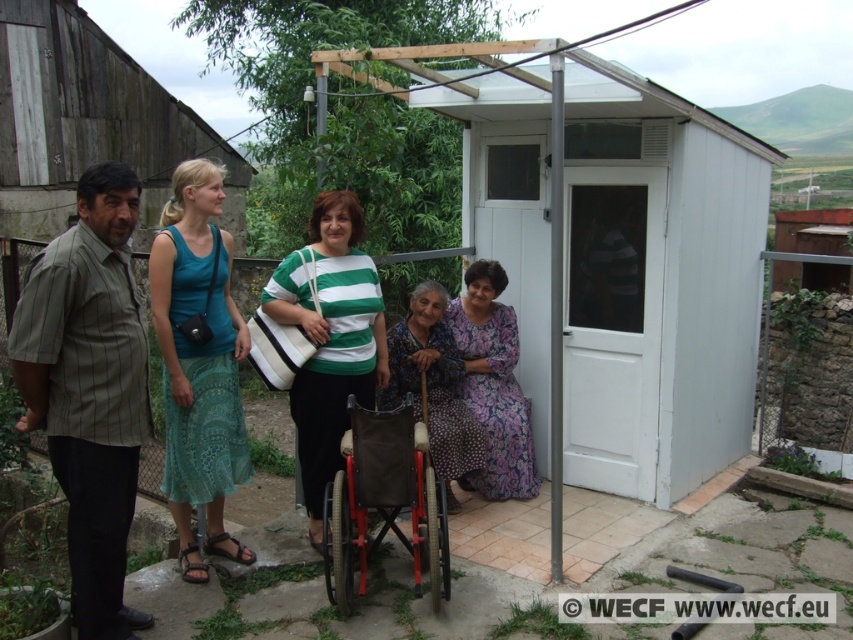
Question: Can you confirm if teal fabric dress at left is positioned below floral dress at lower center?

Choices:
 (A) yes
 (B) no

Answer: (B)

Question: Which object is positioned farthest from the floral dress at lower center?

Choices:
 (A) red metal wheelchair at center
 (B) green striped shirt at center
 (C) printed fabric dress at center

Answer: (A)

Question: Does teal fabric dress at left appear over red metal wheelchair at center?

Choices:
 (A) no
 (B) yes

Answer: (B)

Question: Does white plastic hut at center appear on the right side of green striped shirt at center?

Choices:
 (A) no
 (B) yes

Answer: (B)

Question: Which point is farther to the camera?

Choices:
 (A) white plastic hut at center
 (B) red metal wheelchair at center
 (C) green striped shirt at center

Answer: (C)

Question: Which of the following is the farthest from the observer?

Choices:
 (A) teal fabric dress at left
 (B) red metal wheelchair at center
 (C) striped fabric shirt at left

Answer: (A)